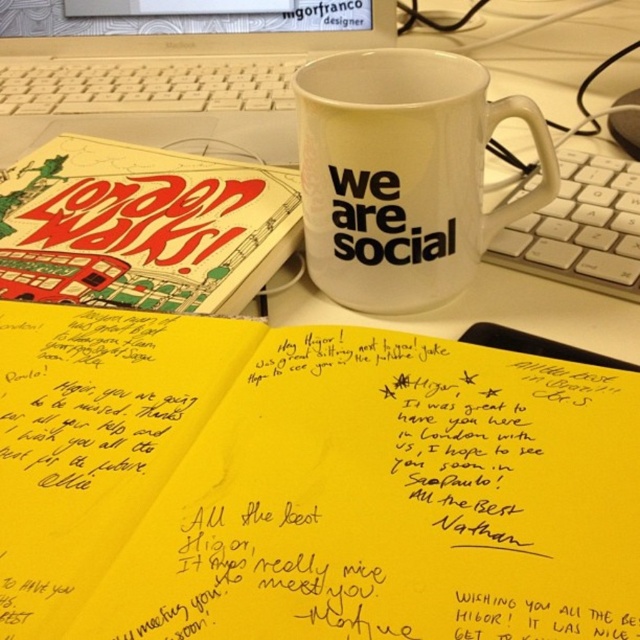
What do you see at coordinates (307, 483) in the screenshot?
I see `yellow paper notebook at center` at bounding box center [307, 483].

Is yellow paper notebook at center taller than matte paper book at upper left?

Incorrect, yellow paper notebook at center's height is not larger of matte paper book at upper left's.

Who is more forward, [464,538] or [145,300]?

Point [464,538] is in front.

The height and width of the screenshot is (640, 640). Find the location of `yellow paper notebook at center`. yellow paper notebook at center is located at coordinates (307, 483).

Consider the image. Between white matte mug at center and white plastic laptop at upper center, which one has less height?

Standing shorter between the two is white matte mug at center.

Is point (298, 83) positioned behind point (17, 109)?

That is False.

The width and height of the screenshot is (640, 640). Find the location of `white matte mug at center`. white matte mug at center is located at coordinates (403, 173).

Looking at this image, how far apart are yellow paper notebook at center and white plastic laptop at upper center?

A distance of 44.58 centimeters exists between yellow paper notebook at center and white plastic laptop at upper center.

Which of these two, yellow paper notebook at center or white plastic laptop at upper center, stands taller?

white plastic laptop at upper center is taller.

The height and width of the screenshot is (640, 640). In order to click on yellow paper notebook at center in this screenshot , I will do `click(307, 483)`.